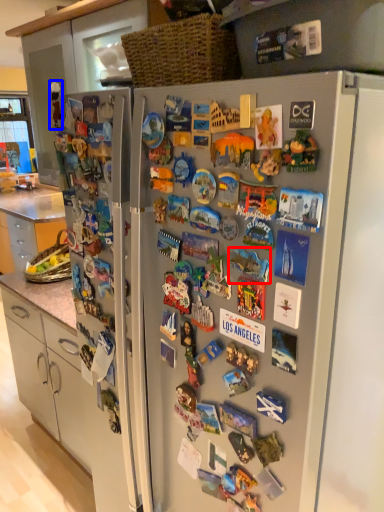
Question: Among these objects, which one is farthest to the camera, toy (highlighted by a red box) or toy (highlighted by a blue box)?

Choices:
 (A) toy
 (B) toy

Answer: (B)